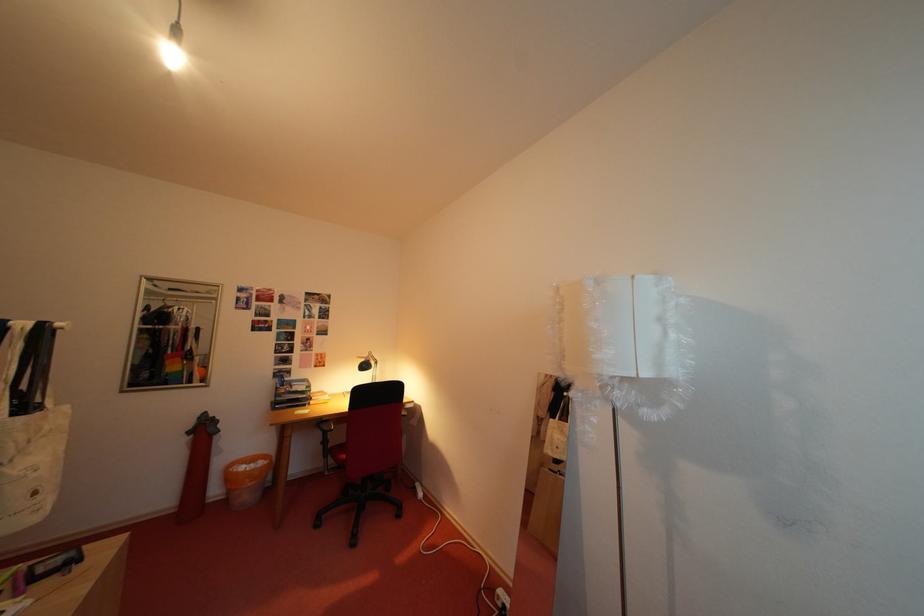
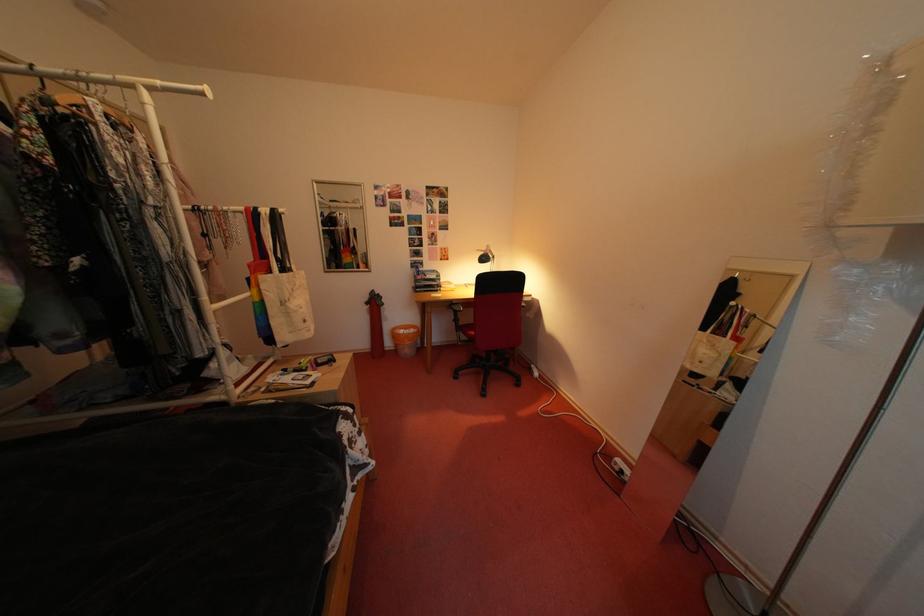
Where in the second image is the point corresponding to the point at 373,365 from the first image?

(492, 257)